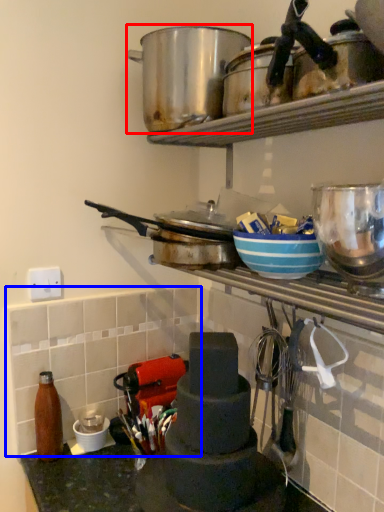
Question: Among these objects, which one is farthest to the camera, crock pot (highlighted by a red box) or tile (highlighted by a blue box)?

Choices:
 (A) crock pot
 (B) tile

Answer: (B)